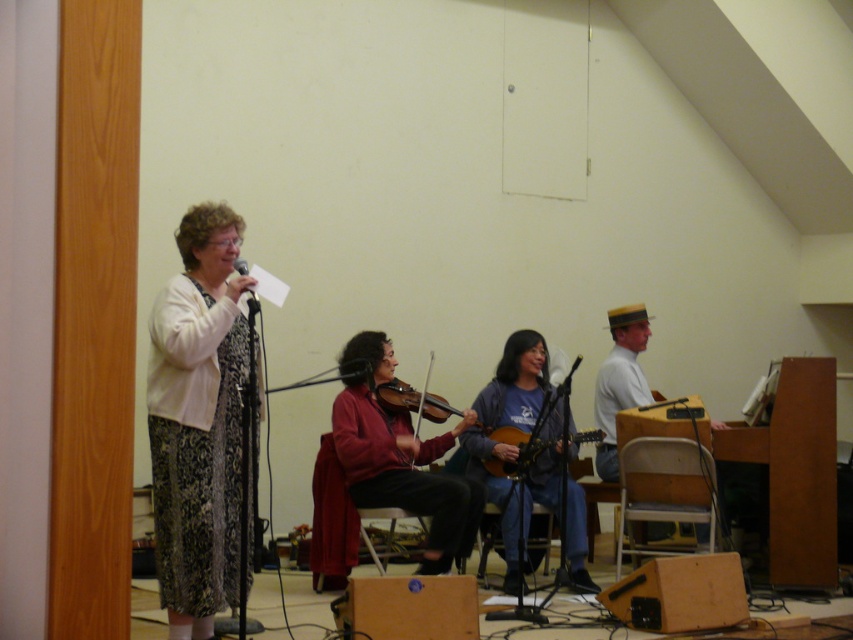
You are an audience member sitting in the front row of the church hall. You notice two performers on stage wearing a red knit sweater at center and a blue cotton shirt at center. Which one is closer to you?

The red knit sweater at center is closer to you because the blue cotton shirt at center is behind it.

You are a photographer trying to capture a clear shot of both the blue cotton shirt at center and the wooden violin at center during the performance. Since you want both subjects to appear similarly sized in the photo, which subject should you move closer to the camera?

The blue cotton shirt at center is larger than the wooden violin at center. To make them appear similarly sized in the photo, you should move the wooden violin at center closer to the camera.